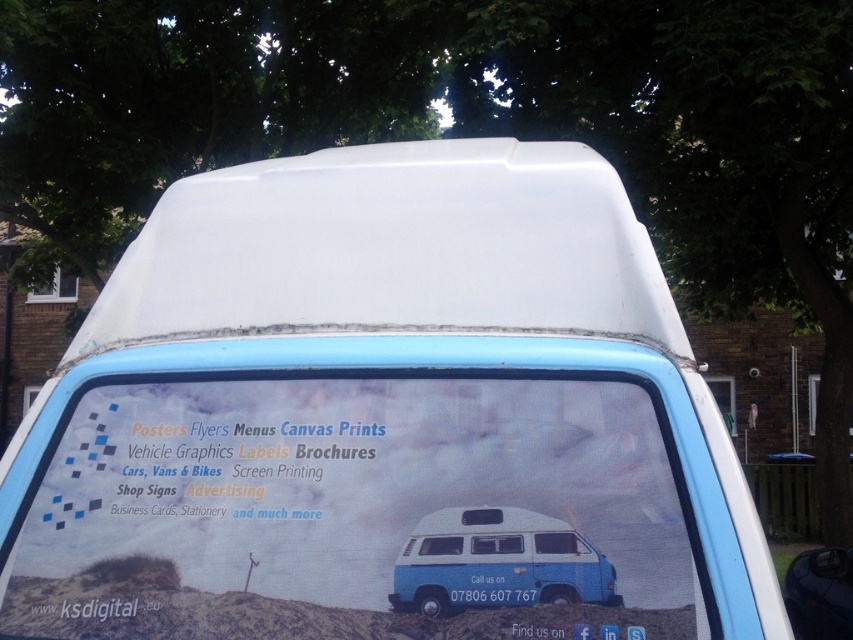
Question: Which point is closer to the camera taking this photo?

Choices:
 (A) (515, 515)
 (B) (619, 344)

Answer: (A)

Question: Is blue matte van at center smaller than white plastic license plate at center?

Choices:
 (A) yes
 (B) no

Answer: (B)

Question: Can you confirm if blue matte van at center is positioned to the left of white plastic license plate at center?

Choices:
 (A) no
 (B) yes

Answer: (A)

Question: Which of the following is the farthest from the observer?

Choices:
 (A) (502, 532)
 (B) (456, 598)

Answer: (A)

Question: Where is blue matte van at center located in relation to white plastic license plate at center in the image?

Choices:
 (A) above
 (B) below

Answer: (A)

Question: Among these points, which one is farthest from the camera?

Choices:
 (A) (480, 296)
 (B) (469, 593)
 (C) (537, 538)

Answer: (A)